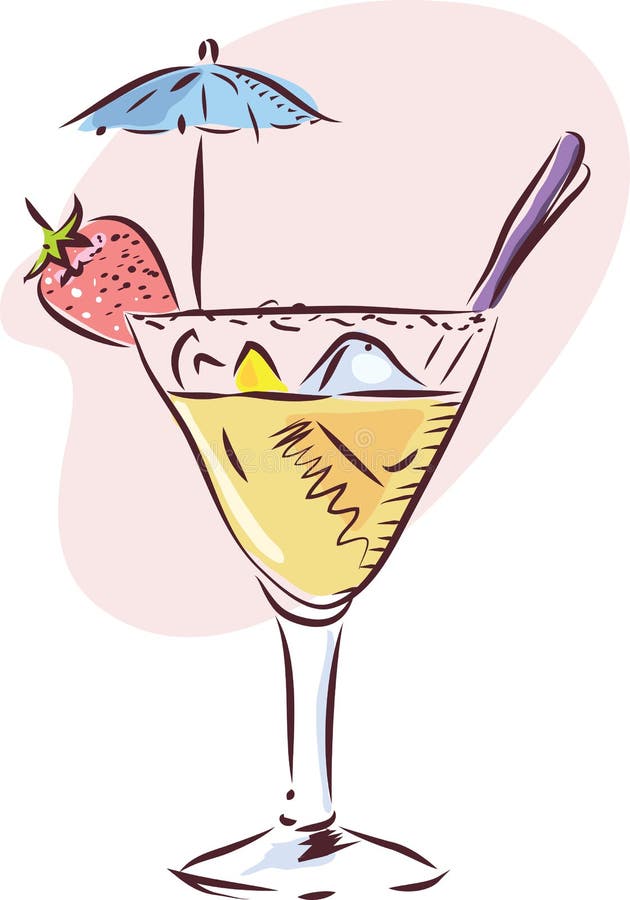
Identify the location of place to hold glass. Image resolution: width=630 pixels, height=900 pixels. (312, 681).